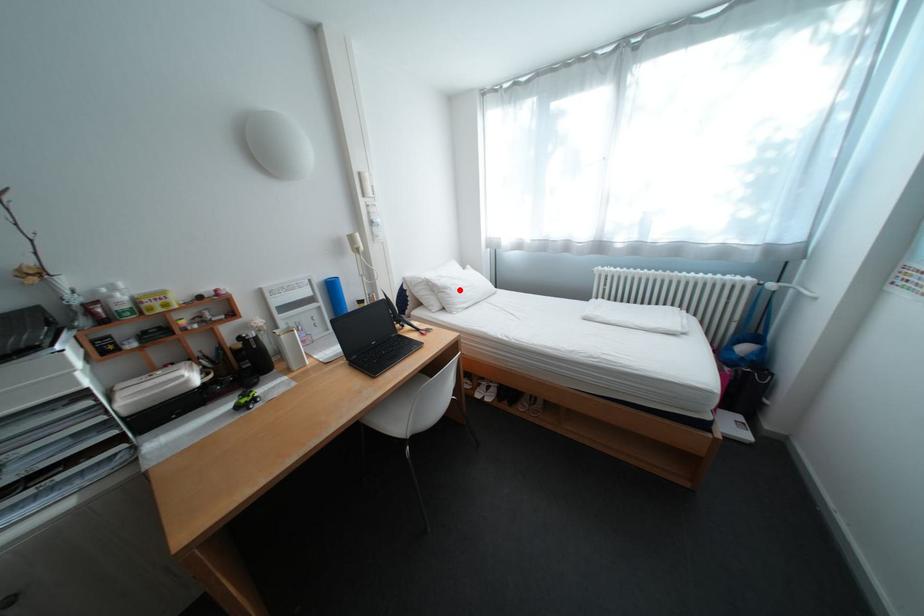
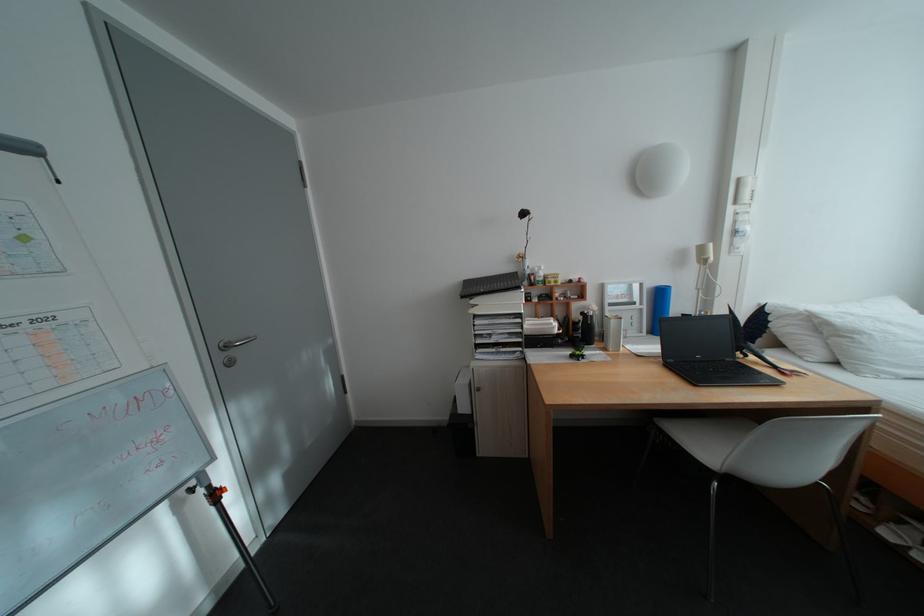
The point at the highlighted location is marked in the first image. Where is the corresponding point in the second image?

(871, 334)